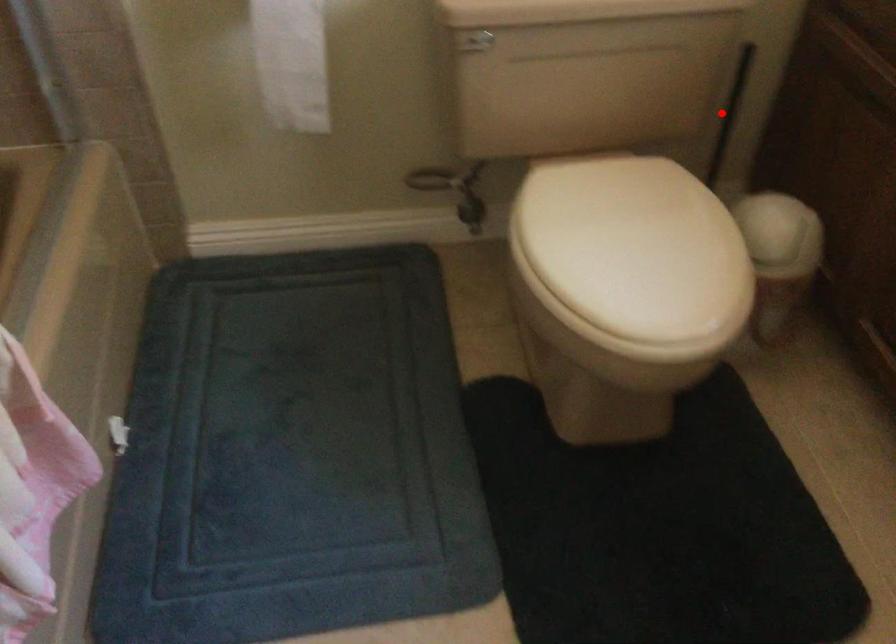
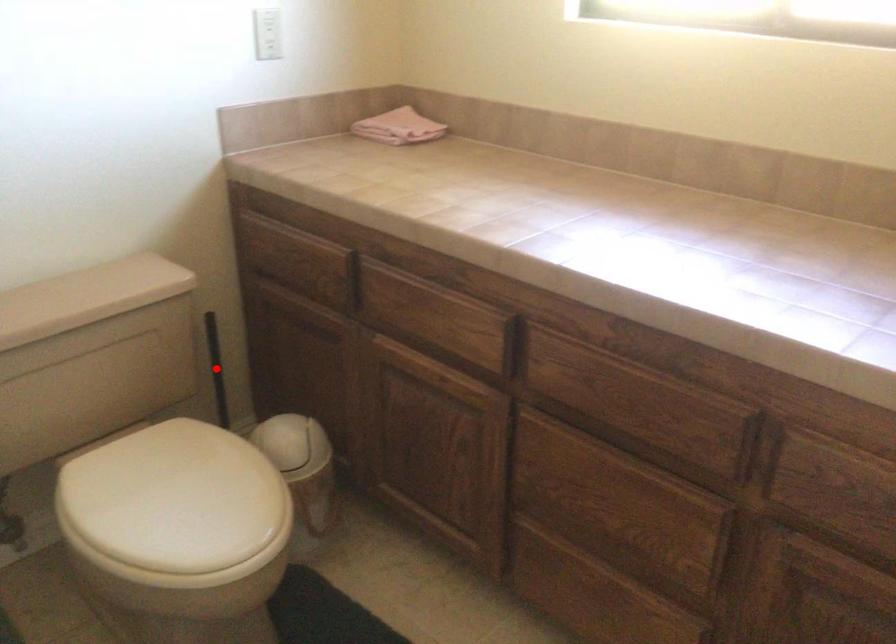
I am providing you with two images of the same scene from different viewpoints. A red point is marked on the first image and another point is marked on the second image. Are the points marked in image1 and image2 representing the same 3D position?

Yes